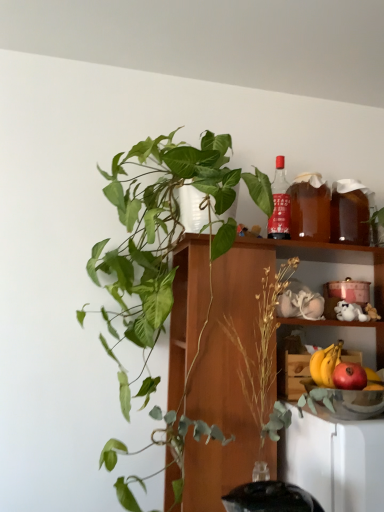
Question: Is translucent amber liquid at shelf right, arranged as the 1th beverage when viewed from the right, outside of yellow matte banana at lower right?

Choices:
 (A) no
 (B) yes

Answer: (B)

Question: Is translucent amber liquid at shelf right, arranged as the 2th beverage when viewed from the left, positioned before yellow matte banana at lower right?

Choices:
 (A) no
 (B) yes

Answer: (A)

Question: Considering the relative positions of translucent amber liquid at shelf right, arranged as the 1th beverage when viewed from the right, and yellow matte banana at lower right in the image provided, is translucent amber liquid at shelf right, arranged as the 1th beverage when viewed from the right, to the right of yellow matte banana at lower right from the viewer's perspective?

Choices:
 (A) no
 (B) yes

Answer: (B)

Question: Is translucent amber liquid at shelf right, arranged as the 2th beverage when viewed from the left, placed right next to yellow matte banana at lower right?

Choices:
 (A) yes
 (B) no

Answer: (B)

Question: From a real-world perspective, is translucent amber liquid at shelf right, arranged as the 2th beverage when viewed from the left, on yellow matte banana at lower right?

Choices:
 (A) yes
 (B) no

Answer: (A)

Question: Is there a large distance between translucent amber liquid at shelf right, arranged as the 1th beverage when viewed from the right, and yellow matte banana at lower right?

Choices:
 (A) yes
 (B) no

Answer: (B)

Question: From a real-world perspective, is yellow matte banana at lower right positioned over transparent glass bowl at lower right based on gravity?

Choices:
 (A) yes
 (B) no

Answer: (A)

Question: Considering the relative positions of yellow matte banana at lower right and transparent glass bowl at lower right in the image provided, is yellow matte banana at lower right behind transparent glass bowl at lower right?

Choices:
 (A) yes
 (B) no

Answer: (A)

Question: Is yellow matte banana at lower right wider than transparent glass bowl at lower right?

Choices:
 (A) yes
 (B) no

Answer: (B)

Question: Is yellow matte banana at lower right facing towards transparent glass bowl at lower right?

Choices:
 (A) yes
 (B) no

Answer: (A)

Question: Is yellow matte banana at lower right outside transparent glass bowl at lower right?

Choices:
 (A) no
 (B) yes

Answer: (B)

Question: Is yellow matte banana at lower right oriented away from transparent glass bowl at lower right?

Choices:
 (A) yes
 (B) no

Answer: (B)

Question: From the image's perspective, is red glass bottle at upper right beneath brown translucent beverage at upper right, the first beverage from the left?

Choices:
 (A) yes
 (B) no

Answer: (B)